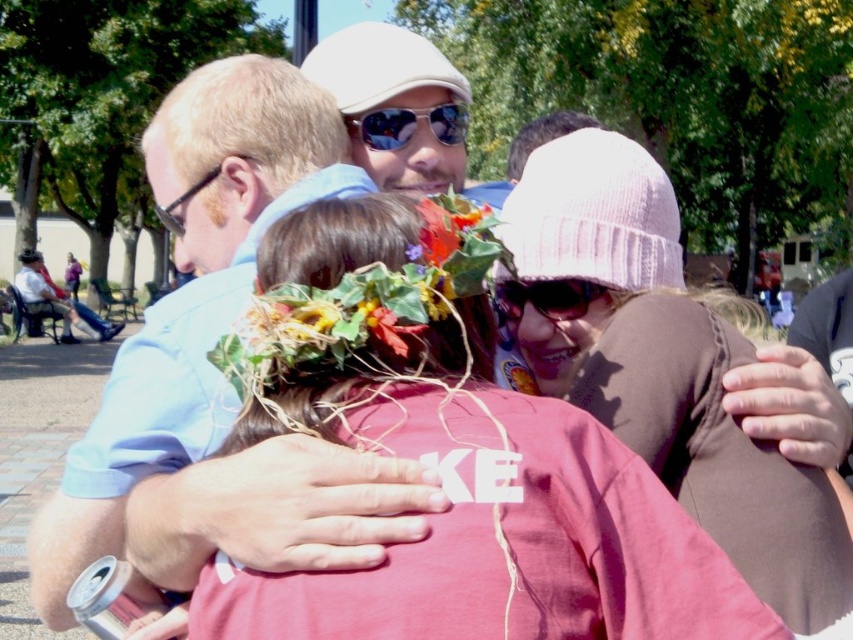
You are a photographer trying to capture both the pink knit hat at center and the pink knit hat at upper right in a single shot. Which hat will appear larger in your photo?

The pink knit hat at center will appear larger because it is closer to the viewer compared to the pink knit hat at upper right.

You are a photographer trying to capture a candid shot of the light blue shirt at upper left and the matte black sunglasses at center. Since you want to ensure both are in focus, you need to know their relative heights. Based on the scene, which object is taller?

The light blue shirt at upper left is much taller as matte black sunglasses at center.

You are a photographer trying to capture a candid shot of the light blue shirt at upper left and the matte black sunglasses at center. Based on their positions, can you tell which object is closer to the camera?

The light blue shirt at upper left is below matte black sunglasses at center, so the matte black sunglasses at center is closer to the camera.